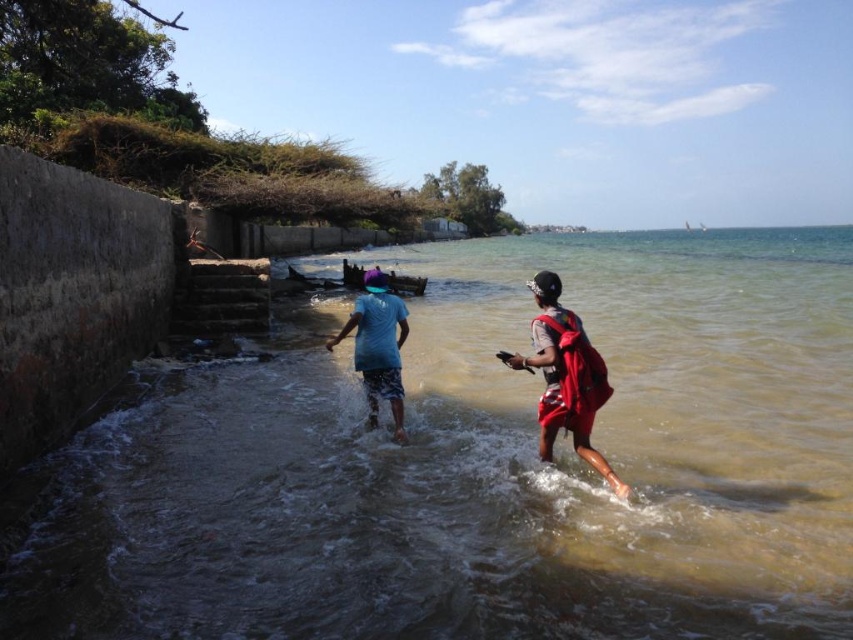
You are a photographer trying to capture both the blue fabric shirt at center and the blue cotton shirt at center in the same frame. Which shirt should you position closer to the camera to ensure both fit in the frame?

Since the blue fabric shirt at center might be wider than blue cotton shirt at center, you should position the blue fabric shirt at center closer to the camera to ensure it fits within the frame along with the other shirt.

You are a photographer standing at the edge of the water. You want to take a photo of the blue fabric shirt at center and the red fabric bag at center so that both are clearly visible in the frame. Given that your camera has a minimum focus distance of 20 inches, will you need to adjust your position to ensure both subjects are in focus?

The blue fabric shirt at center is 25.66 inches away from the red fabric bag at center. Since the minimum focus distance is 20 inches, the camera can focus on both subjects as they are within the required distance. No adjustment is needed.

You are standing at the coastal area scene. There is a point marked at coordinates (566, 376). What object is located exactly at that point?

The blue fabric shirt at center is located exactly at point (566, 376).